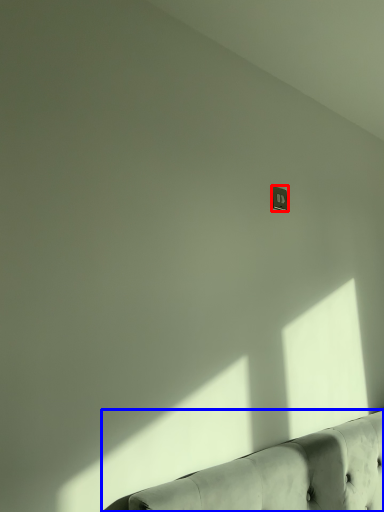
Question: Which of the following is the farthest to the observer, electric outlet (highlighted by a red box) or studio couch (highlighted by a blue box)?

Choices:
 (A) electric outlet
 (B) studio couch

Answer: (A)